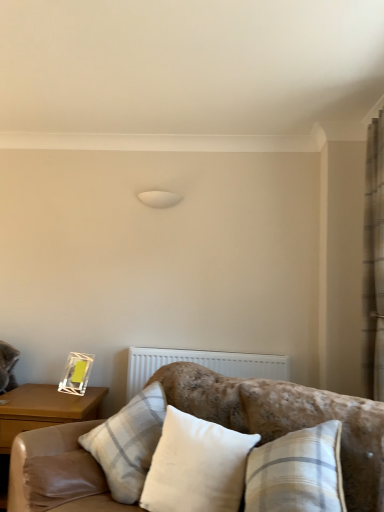
At what (x,y) coordinates should I click in order to perform the action: click on white fabric pillow at center, which is counted as the first pillow, starting from the back. Please return your answer as a coordinate pair (x, y). Looking at the image, I should click on (128, 443).

What do you see at coordinates (202, 365) in the screenshot? I see `white textured radiator at center` at bounding box center [202, 365].

In order to face velvet beige couch at lower center, should I rotate leftwards or rightwards?

It's best to rotate right around 1.925 degrees.

Describe the element at coordinates (374, 262) in the screenshot. This screenshot has height=512, width=384. I see `beige textured curtain at right` at that location.

Measure the distance between point (378, 118) and camera.

2.30 meters.

Where is `white fabric pillow at center, which is counted as the first pillow, starting from the back`? white fabric pillow at center, which is counted as the first pillow, starting from the back is located at coordinates (128, 443).

Locate an element on the screen. The height and width of the screenshot is (512, 384). curtain on the right of white textured radiator at center is located at coordinates (374, 262).

Between point (285, 371) and point (383, 311), which one is positioned in front?

The point (383, 311) is in front.

From the picture: From the image's perspective, between white textured radiator at center and beige textured curtain at right, which one is located above?

beige textured curtain at right is shown above in the image.

In terms of height, does white textured radiator at center look taller or shorter compared to beige textured curtain at right?

Considering their sizes, white textured radiator at center has less height than beige textured curtain at right.

Which is more to the right, white cotton pillow at center, which ranks as the 1th pillow in front-to-back order, or velvet beige couch at lower center?

Positioned to the right is velvet beige couch at lower center.

Are white cotton pillow at center, which ranks as the 1th pillow in front-to-back order, and velvet beige couch at lower center located far from each other?

No.

From the image's perspective, is white cotton pillow at center, which ranks as the 1th pillow in front-to-back order, located above or below velvet beige couch at lower center?

white cotton pillow at center, which ranks as the 1th pillow in front-to-back order, is situated higher than velvet beige couch at lower center in the image.

This screenshot has height=512, width=384. I want to click on studio couch in front of the white cotton pillow at center, which ranks as the 1th pillow in front-to-back order, so click(x=287, y=419).

Does point (173, 391) come closer to viewer compared to point (370, 150)?

Yes, point (173, 391) is in front of point (370, 150).

From a real-world perspective, does velvet beige couch at lower center stand above beige textured curtain at right?

No, from a real-world perspective, velvet beige couch at lower center is not above beige textured curtain at right.

Considering the relative sizes of velvet beige couch at lower center and beige textured curtain at right in the image provided, is velvet beige couch at lower center wider than beige textured curtain at right?

Indeed, velvet beige couch at lower center has a greater width compared to beige textured curtain at right.

How different are the orientations of wooden nightstand at left and velvet beige couch at lower center in degrees?

The facing directions of wooden nightstand at left and velvet beige couch at lower center are 42.9 degrees apart.

In terms of size, does wooden nightstand at left appear bigger or smaller than velvet beige couch at lower center?

wooden nightstand at left is smaller than velvet beige couch at lower center.

Between wooden nightstand at left and velvet beige couch at lower center, which one appears on the left side from the viewer's perspective?

Positioned to the left is wooden nightstand at left.

Is wooden nightstand at left thinner than velvet beige couch at lower center?

Correct, the width of wooden nightstand at left is less than that of velvet beige couch at lower center.

Can you confirm if beige textured curtain at right is smaller than velvet beige couch at lower center?

Indeed, beige textured curtain at right has a smaller size compared to velvet beige couch at lower center.

Which is closer to the camera, (378, 391) or (345, 478)?

Point (378, 391) is farther from the camera than point (345, 478).

From a real-world perspective, is beige textured curtain at right positioned above or below velvet beige couch at lower center?

beige textured curtain at right is above velvet beige couch at lower center.

Is there a large distance between beige textured curtain at right and velvet beige couch at lower center?

No, beige textured curtain at right is not far from velvet beige couch at lower center.

From the image's perspective, which is above, white fabric pillow at center, marked as the second pillow in a front-to-back arrangement, or velvet beige couch at lower center?

white fabric pillow at center, marked as the second pillow in a front-to-back arrangement, from the image's perspective.

Is white fabric pillow at center, marked as the second pillow in a front-to-back arrangement, inside the boundaries of velvet beige couch at lower center, or outside?

white fabric pillow at center, marked as the second pillow in a front-to-back arrangement, can be found inside velvet beige couch at lower center.

Considering the relative sizes of white fabric pillow at center, which is counted as the first pillow, starting from the back, and velvet beige couch at lower center in the image provided, is white fabric pillow at center, which is counted as the first pillow, starting from the back, shorter than velvet beige couch at lower center?

Correct, white fabric pillow at center, which is counted as the first pillow, starting from the back, is not as tall as velvet beige couch at lower center.

Which point is more forward, (165, 405) or (344, 451)?

The point (344, 451) is more forward.

Does white cotton pillow at center, which ranks as the 1th pillow in front-to-back order, lie behind wooden nightstand at left?

No, white cotton pillow at center, which ranks as the 1th pillow in front-to-back order, is closer to the viewer.

Is white cotton pillow at center, which ranks as the 1th pillow in front-to-back order, situated inside wooden nightstand at left or outside?

white cotton pillow at center, which ranks as the 1th pillow in front-to-back order, is located beyond the bounds of wooden nightstand at left.

Is white cotton pillow at center, which ranks as the 2th pillow in back-to-front order, looking in the opposite direction of wooden nightstand at left?

No, white cotton pillow at center, which ranks as the 2th pillow in back-to-front order, is not facing the opposite direction of wooden nightstand at left.

The image size is (384, 512). There is a white textured radiator at center. Find the location of `curtain above it (from a real-world perspective)`. curtain above it (from a real-world perspective) is located at coordinates (374, 262).

In the image, there is a white cotton pillow at center, which ranks as the 2th pillow in back-to-front order. Identify the location of studio couch below it (from the image's perspective). The width and height of the screenshot is (384, 512). (287, 419).

Based on their spatial positions, is wooden nightstand at left or white cotton pillow at center, which ranks as the 1th pillow in front-to-back order, further from velvet beige couch at lower center?

wooden nightstand at left lies further to velvet beige couch at lower center than the other object.

From the image, which object appears to be nearer to wooden nightstand at left, beige textured curtain at right or white cotton pillow at center, which ranks as the 1th pillow in front-to-back order?

white cotton pillow at center, which ranks as the 1th pillow in front-to-back order.

Considering their positions, is white fabric pillow at center, marked as the second pillow in a front-to-back arrangement, positioned further to wooden nightstand at left than velvet beige couch at lower center?

velvet beige couch at lower center is positioned further to the anchor wooden nightstand at left.

Based on their spatial positions, is velvet beige couch at lower center or white textured radiator at center closer to white fabric pillow at center, marked as the second pillow in a front-to-back arrangement?

Among the two, velvet beige couch at lower center is located nearer to white fabric pillow at center, marked as the second pillow in a front-to-back arrangement.

Based on their spatial positions, is velvet beige couch at lower center or white cotton pillow at center, which ranks as the 2th pillow in back-to-front order, further from white textured radiator at center?

white cotton pillow at center, which ranks as the 2th pillow in back-to-front order, is further to white textured radiator at center.

When comparing their distances from white cotton pillow at center, which ranks as the 1th pillow in front-to-back order, does white textured radiator at center or velvet beige couch at lower center seem further?

white textured radiator at center.

Looking at the image, which one is located further to white cotton pillow at center, which ranks as the 2th pillow in back-to-front order, velvet beige couch at lower center or wooden nightstand at left?

wooden nightstand at left.

In the scene shown: Based on their spatial positions, is beige textured curtain at right or white fabric pillow at center, which is counted as the first pillow, starting from the back, further from velvet beige couch at lower center?

Among the two, beige textured curtain at right is located further to velvet beige couch at lower center.

This screenshot has height=512, width=384. Identify the location of radiator between white fabric pillow at center, marked as the second pillow in a front-to-back arrangement, and beige textured curtain at right, in the horizontal direction. (202, 365).

This screenshot has width=384, height=512. I want to click on nightstand between white cotton pillow at center, which ranks as the 1th pillow in front-to-back order, and white textured radiator at center from front to back, so click(44, 409).

This screenshot has width=384, height=512. Identify the location of curtain between velvet beige couch at lower center and white textured radiator at center from front to back. (374, 262).

At what (x,y) coordinates should I click in order to perform the action: click on radiator between wooden nightstand at left and beige textured curtain at right in the horizontal direction. Please return your answer as a coordinate pair (x, y). This screenshot has width=384, height=512. Looking at the image, I should click on (202, 365).